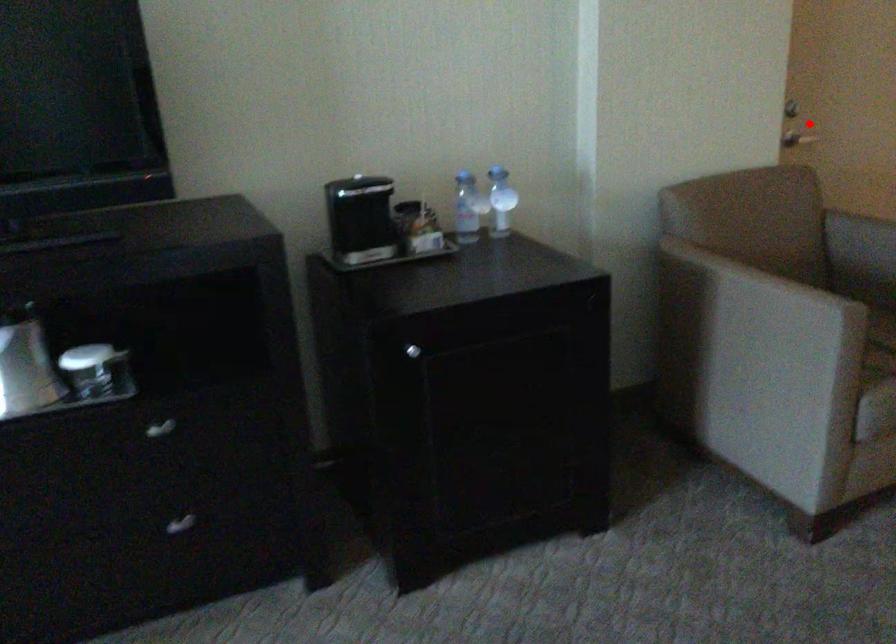
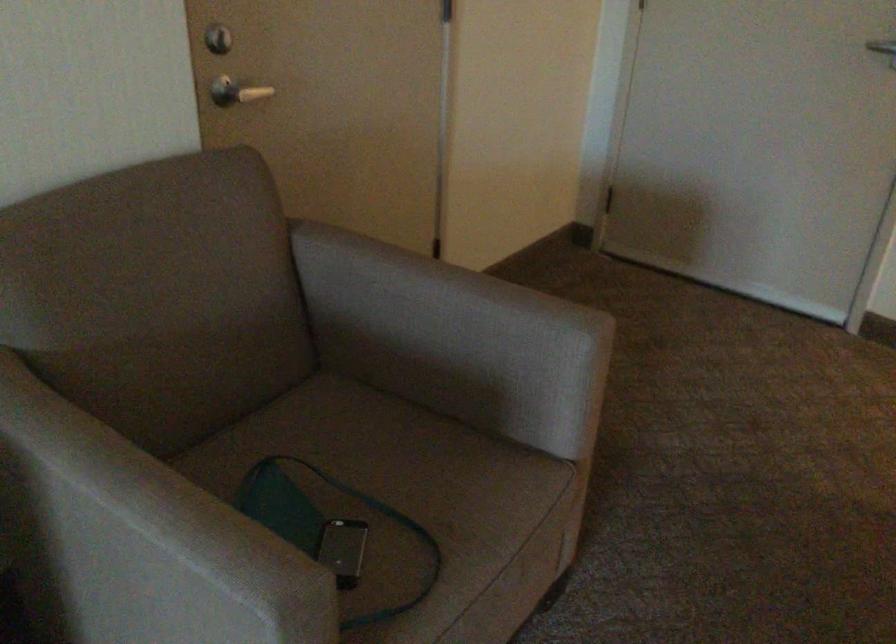
Where in the second image is the point corresponding to the highlighted location from the first image?

(236, 91)